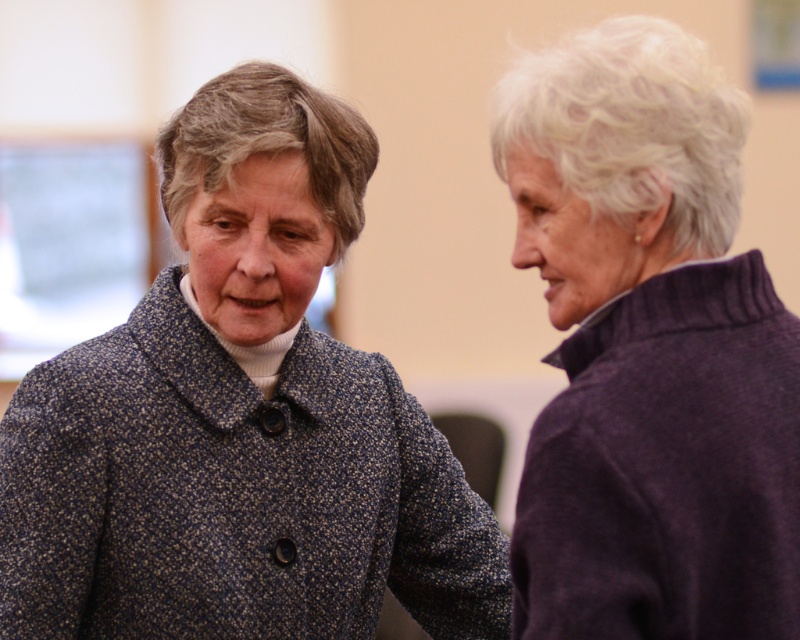
Between floral-patterned fabric coat at left and purple wool sweater at right, which one has less height?

Standing shorter between the two is purple wool sweater at right.

Is point (282, 579) in front of point (588, 557)?

No.

Locate an element on the screen. The width and height of the screenshot is (800, 640). floral-patterned fabric coat at left is located at coordinates (232, 493).

This screenshot has height=640, width=800. Identify the location of floral-patterned fabric coat at left. coord(232,493).